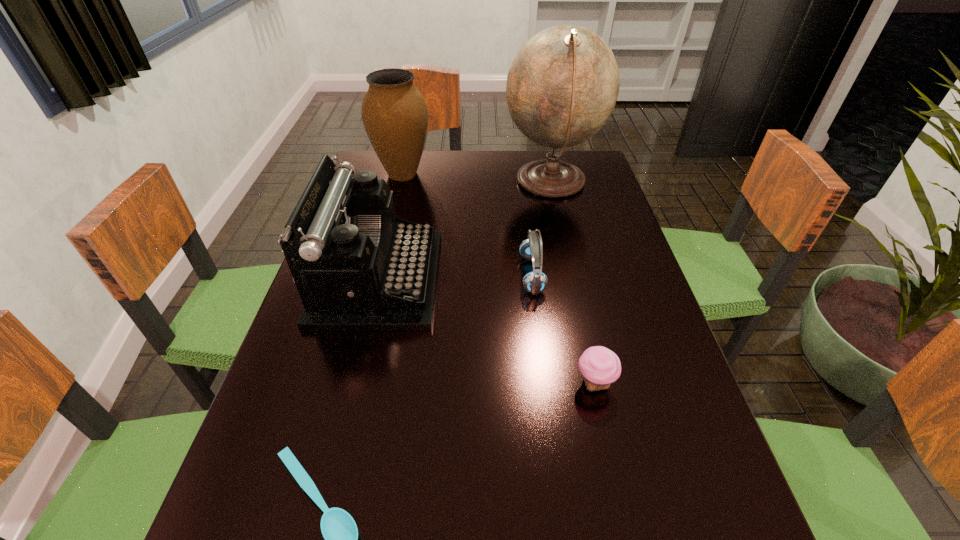
Identify the location of free space between the fifth shortest object and the second nearest object. (498, 279).

Where is `free area in between the second tallest object and the globe`? free area in between the second tallest object and the globe is located at coordinates (477, 178).

Where is `unoccupied position between the urn and the headset`? unoccupied position between the urn and the headset is located at coordinates (468, 224).

Identify which object is located as the fourth nearest to the fifth shortest object. Please provide its 2D coordinates. Your answer should be formatted as a tuple, i.e. [(x, y)], where the tuple contains the x and y coordinates of a point satisfying the conditions above.

[(600, 367)]

At what (x,y) coordinates should I click in order to perform the action: click on object that is the closest to the tallest object. Please return your answer as a coordinate pair (x, y). Looking at the image, I should click on (535, 281).

The width and height of the screenshot is (960, 540). What are the coordinates of `free point that satisfies the following two spatial constraints: 1. on the typing side of the third tallest object; 2. on the back side of the fifth tallest object` in the screenshot? It's located at (352, 383).

The height and width of the screenshot is (540, 960). In order to click on vacant region that satisfies the following two spatial constraints: 1. on the back side of the cupcake; 2. on the ear cups of the headset in this screenshot , I will do `click(570, 274)`.

The image size is (960, 540). Identify the location of free location that satisfies the following two spatial constraints: 1. on the typing side of the third tallest object; 2. on the back side of the cupcake. (352, 383).